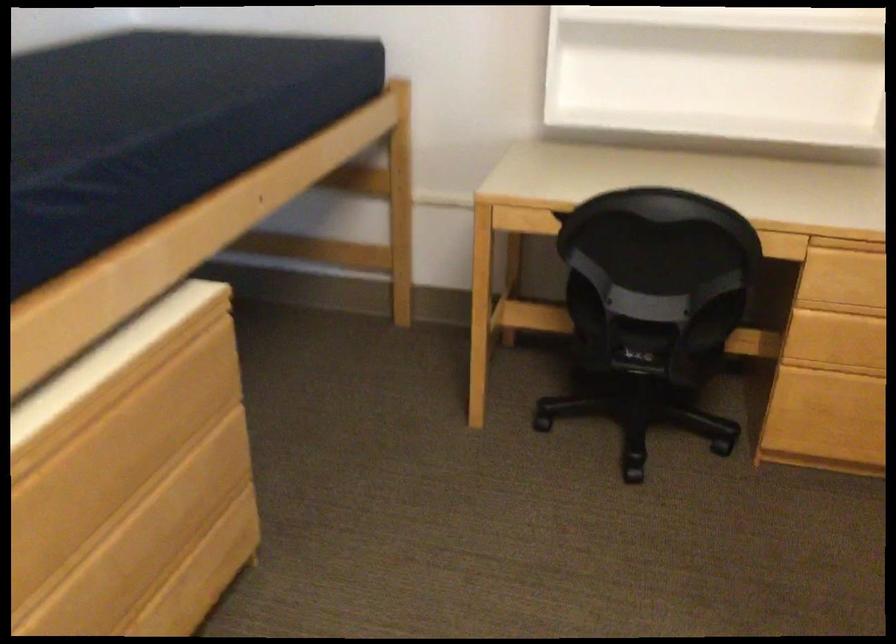
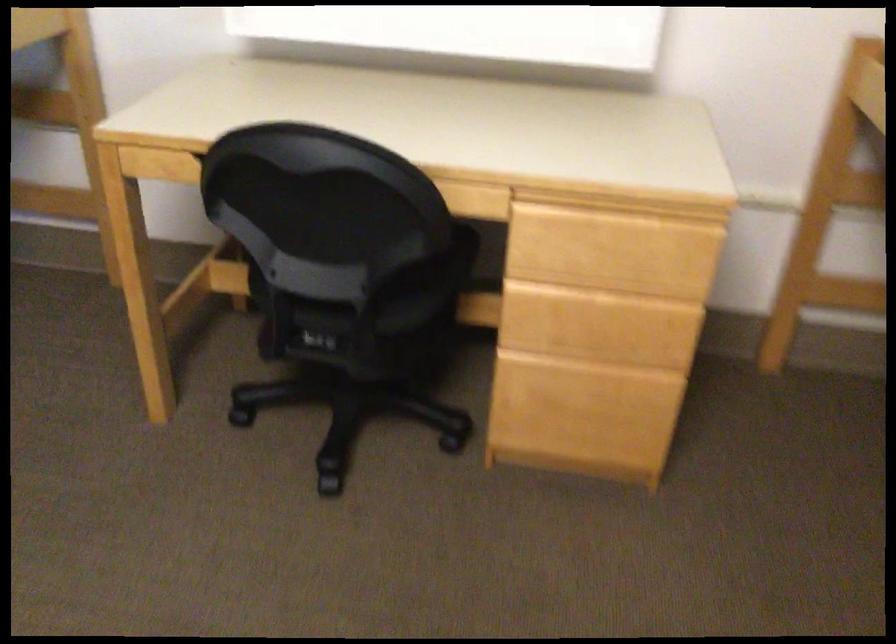
What movement of the cameraman would produce the second image?

The cameraman walked toward right, forward.